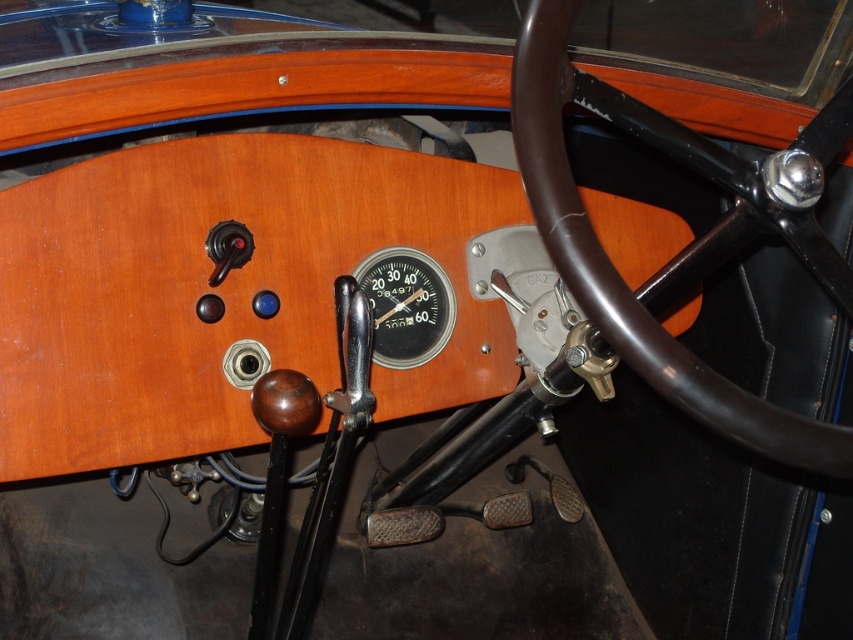
You are a mechanic working on a vintage car. You need to install a new control panel between the brown leather steering wheel at center and the metallic silver gauge at center. The panel requires 20 inches of space. Can you fit it between them?

The distance between the brown leather steering wheel at center and the metallic silver gauge at center is 21.07 inches, so yes, the control panel requiring 20 inches of space can fit between them since there is enough room.

You are a mechanic inspecting the dashboard of this vintage car. You need to determine if a new tool you have, which is 10 inches wide, can fit between the brown leather steering wheel at center and the metallic silver gauge at center. Can the tool fit?

The brown leather steering wheel at center has a larger width than the metallic silver gauge at center. Since the tool is 10 inches wide, but the exact width of the gap between them isn

You are sitting in the driver seat of the vintage car. You want to reach the brown leather steering wheel at center. Where should you look to find it?

The brown leather steering wheel at center is located at point (622, 280), so you should look towards the center of the dashboard slightly lower down to find it.